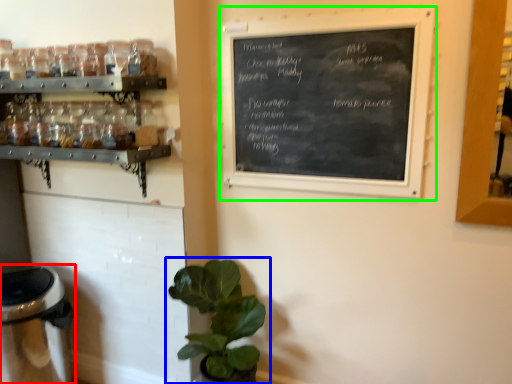
Question: Which object is the farthest from appliance (highlighted by a red box)? Choose among these: houseplant (highlighted by a blue box) or bulletin board (highlighted by a green box).

Choices:
 (A) houseplant
 (B) bulletin board

Answer: (B)